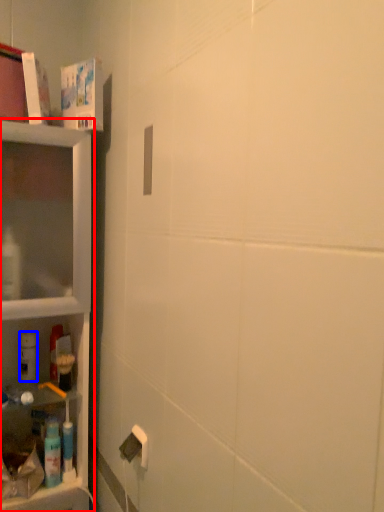
Question: Which object appears closest to the camera in this image, shelf (highlighted by a red box) or cleaning product (highlighted by a blue box)?

Choices:
 (A) shelf
 (B) cleaning product

Answer: (A)